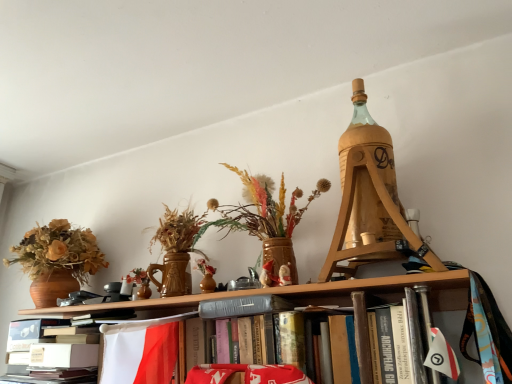
What do you see at coordinates (55, 346) in the screenshot?
I see `white paper at lower left` at bounding box center [55, 346].

What are the coordinates of `gray fabric bookshelf at center` in the screenshot? It's located at (314, 294).

From the image's perspective, which is below, white paper at lower left or wooden tripod at upper right?

white paper at lower left.

Is point (12, 351) farther from viewer compared to point (348, 220)?

Yes.

Looking at this image, what's the angular difference between white paper at lower left and wooden tripod at upper right's facing directions?

0.299 degrees separate the facing orientations of white paper at lower left and wooden tripod at upper right.

Identify the location of Eiffel tower positioned vertically above the white paper at lower left (from a real-world perspective). (369, 198).

Based on the photo, are wooden tripod at upper right and gray fabric bookshelf at center located far from each other?

Actually, wooden tripod at upper right and gray fabric bookshelf at center are a little close together.

Measure the distance from wooden tripod at upper right to gray fabric bookshelf at center.

8.31 inches.

Considering the relative sizes of wooden tripod at upper right and gray fabric bookshelf at center in the image provided, is wooden tripod at upper right thinner than gray fabric bookshelf at center?

No.

In the scene shown: Which of these two, wooden tripod at upper right or gray fabric bookshelf at center, is smaller?

wooden tripod at upper right is smaller.

From the picture: From the image's perspective, which one is positioned higher, wooden tripod at upper right or white paper at lower left?

wooden tripod at upper right is shown above in the image.

Can you see wooden tripod at upper right touching white paper at lower left?

No, wooden tripod at upper right is not with white paper at lower left.

Considering the sizes of objects wooden tripod at upper right and white paper at lower left in the image provided, who is bigger, wooden tripod at upper right or white paper at lower left?

With larger size is wooden tripod at upper right.

What's the angular difference between gray fabric bookshelf at center and wooden tripod at upper right's facing directions?

0.0863 degrees separate the facing orientations of gray fabric bookshelf at center and wooden tripod at upper right.

From the image's perspective, is gray fabric bookshelf at center under wooden tripod at upper right?

Indeed, from the image's perspective, gray fabric bookshelf at center is shown beneath wooden tripod at upper right.

The width and height of the screenshot is (512, 384). Find the location of `Eiffel tower above the gray fabric bookshelf at center (from the image's perspective)`. Eiffel tower above the gray fabric bookshelf at center (from the image's perspective) is located at coordinates (369, 198).

Does gray fabric bookshelf at center have a greater height compared to wooden tripod at upper right?

No, gray fabric bookshelf at center is not taller than wooden tripod at upper right.

Considering the relative positions of gray fabric bookshelf at center and white paper at lower left in the image provided, is gray fabric bookshelf at center behind white paper at lower left?

No, it is not.

Does gray fabric bookshelf at center touch white paper at lower left?

No, gray fabric bookshelf at center is not making contact with white paper at lower left.

From the image's perspective, which one is positioned higher, gray fabric bookshelf at center or white paper at lower left?

From the image's view, gray fabric bookshelf at center is above.

Does gray fabric bookshelf at center have a lesser width compared to white paper at lower left?

Yes, gray fabric bookshelf at center is thinner than white paper at lower left.

Does white paper at lower left appear on the left side of gray fabric bookshelf at center?

Indeed, white paper at lower left is positioned on the left side of gray fabric bookshelf at center.

Is white paper at lower left facing towards gray fabric bookshelf at center?

No, white paper at lower left is not aimed at gray fabric bookshelf at center.

Are white paper at lower left and gray fabric bookshelf at center far apart?

No, there isn't a large distance between white paper at lower left and gray fabric bookshelf at center.

Considering the points (64, 377) and (238, 293), which point is in front, point (64, 377) or point (238, 293)?

The point (238, 293) is closer.

In order to click on Eiffel tower that appears above the white paper at lower left (from a real-world perspective) in this screenshot , I will do `click(369, 198)`.

Image resolution: width=512 pixels, height=384 pixels. I want to click on shelf in front of the wooden tripod at upper right, so click(314, 294).

Based on their spatial positions, is white paper at lower left or gray fabric bookshelf at center further from wooden tripod at upper right?

white paper at lower left is positioned further to the anchor wooden tripod at upper right.

Which object lies further to the anchor point gray fabric bookshelf at center, white paper at lower left or wooden tripod at upper right?

wooden tripod at upper right is positioned further to the anchor gray fabric bookshelf at center.

Based on the photo, considering their positions, is gray fabric bookshelf at center positioned closer to white paper at lower left than wooden tripod at upper right?

Based on the image, gray fabric bookshelf at center appears to be nearer to white paper at lower left.

Estimate the real-world distances between objects in this image. Which object is closer to white paper at lower left, wooden tripod at upper right or gray fabric bookshelf at center?

gray fabric bookshelf at center is positioned closer to the anchor white paper at lower left.

Based on their spatial positions, is gray fabric bookshelf at center or white paper at lower left further from wooden tripod at upper right?

white paper at lower left.

Estimate the real-world distances between objects in this image. Which object is further from gray fabric bookshelf at center, wooden tripod at upper right or white paper at lower left?

wooden tripod at upper right is positioned further to the anchor gray fabric bookshelf at center.

Where is `shelf between white paper at lower left and wooden tripod at upper right in the horizontal direction`? shelf between white paper at lower left and wooden tripod at upper right in the horizontal direction is located at coordinates (314, 294).